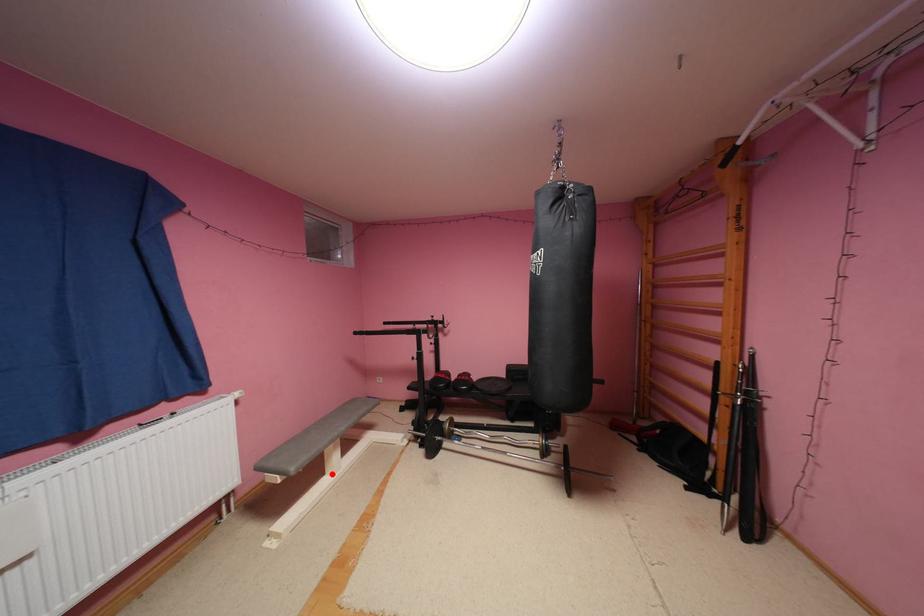
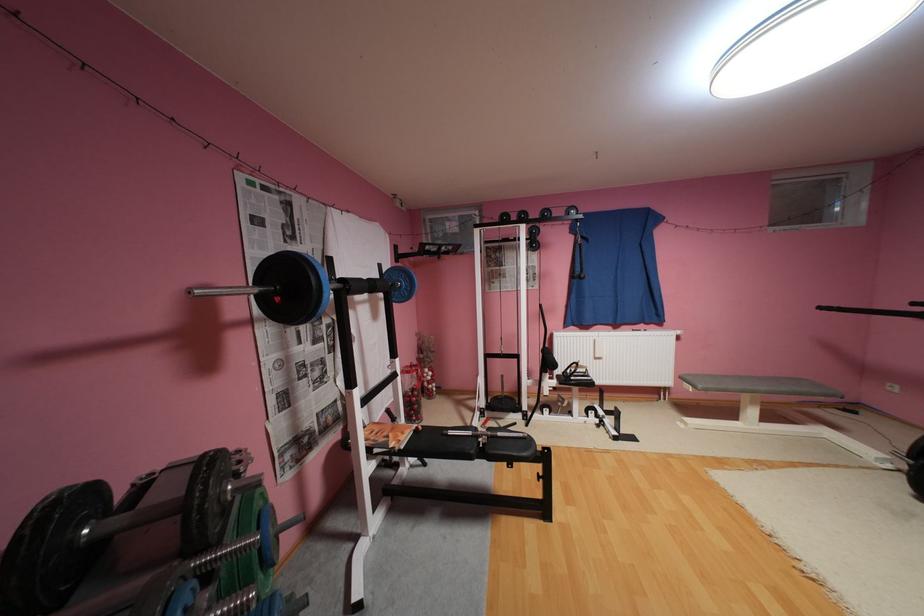
The point at the highlighted location is marked in the first image. Where is the corresponding point in the second image?

(746, 419)